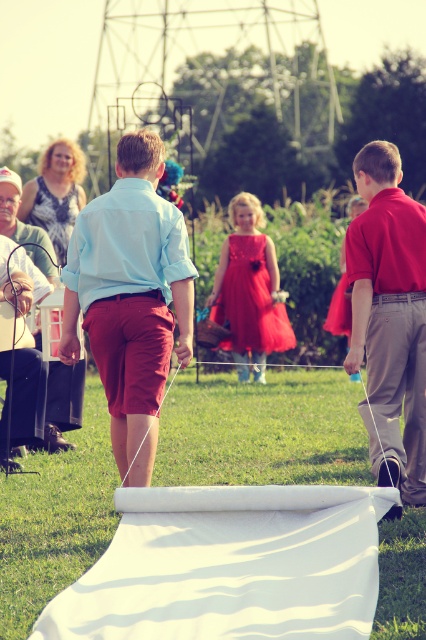
Which is in front, point (131, 476) or point (362, 413)?

Point (131, 476) is in front.

Is point (152, 451) positioned behind point (399, 513)?

Yes, point (152, 451) is farther from viewer.

Does point (157, 195) come farther from viewer compared to point (420, 412)?

No, (157, 195) is closer to viewer.

The height and width of the screenshot is (640, 426). Find the location of `light blue cotton shirt at center`. light blue cotton shirt at center is located at coordinates (129, 291).

Between matte red shirt at right and shiny taffeta dress at center, which one is positioned lower?

matte red shirt at right

Is matte red shirt at right thinner than shiny taffeta dress at center?

Correct, matte red shirt at right's width is less than shiny taffeta dress at center's.

The image size is (426, 640). What are the coordinates of `matte red shirt at right` in the screenshot? It's located at (389, 317).

Does white string at center appear on the right side of matte red shirt at right?

Incorrect, white string at center is not on the right side of matte red shirt at right.

Can you confirm if white string at center is positioned above matte red shirt at right?

No.

Is point (357, 440) positioned before point (368, 145)?

No.

Where is `white string at center`? The height and width of the screenshot is (640, 426). white string at center is located at coordinates (262, 429).